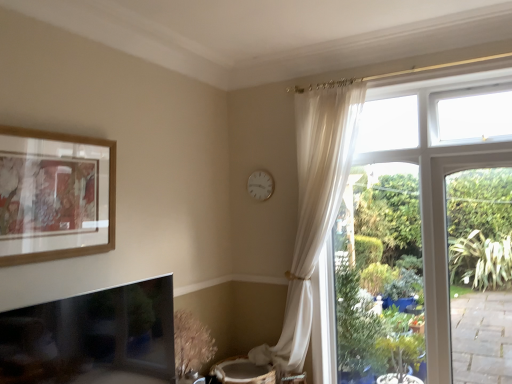
At what (x,y) coordinates should I click in order to perform the action: click on white plastic clock at upper center. Please return your answer as a coordinate pair (x, y). This screenshot has height=384, width=512. Looking at the image, I should click on (260, 185).

The image size is (512, 384). What do you see at coordinates (260, 185) in the screenshot?
I see `white plastic clock at upper center` at bounding box center [260, 185].

What is the approximate width of wooden picture frame at upper left?

It is 2.48 inches.

I want to click on wooden picture frame at upper left, so pyautogui.click(x=55, y=196).

In order to face wooden picture frame at upper left, should I rotate leftwards or rightwards?

Rotate left and turn 24.386 degrees.

This screenshot has width=512, height=384. Describe the element at coordinates (55, 196) in the screenshot. I see `wooden picture frame at upper left` at that location.

I want to click on white plastic clock at upper center, so click(260, 185).

Can you confirm if wooden picture frame at upper left is positioned to the left of white plastic clock at upper center?

Correct, you'll find wooden picture frame at upper left to the left of white plastic clock at upper center.

Relative to white plastic clock at upper center, is wooden picture frame at upper left in front or behind?

Visually, wooden picture frame at upper left is located in front of white plastic clock at upper center.

Is point (38, 150) closer or farther from the camera than point (252, 191)?

Point (38, 150) is positioned closer to the camera compared to point (252, 191).

From the image's perspective, does wooden picture frame at upper left appear lower than white plastic clock at upper center?

Correct, wooden picture frame at upper left appears lower than white plastic clock at upper center in the image.

From a real-world perspective, is wooden picture frame at upper left positioned under white plastic clock at upper center based on gravity?

Yes, from a real-world perspective, wooden picture frame at upper left is under white plastic clock at upper center.

Which of these two, wooden picture frame at upper left or white plastic clock at upper center, is wider?

With larger width is wooden picture frame at upper left.

Considering the relative sizes of wooden picture frame at upper left and white plastic clock at upper center in the image provided, is wooden picture frame at upper left shorter than white plastic clock at upper center?

No.

Between wooden picture frame at upper left and white plastic clock at upper center, which one has larger size?

With larger size is wooden picture frame at upper left.

Looking at this image, is wooden picture frame at upper left surrounding white plastic clock at upper center?

That's incorrect, white plastic clock at upper center is not inside wooden picture frame at upper left.

Would you consider wooden picture frame at upper left to be distant from white plastic clock at upper center?

Yes, wooden picture frame at upper left and white plastic clock at upper center are located far from each other.

Is wooden picture frame at upper left oriented towards white plastic clock at upper center?

No, wooden picture frame at upper left is not oriented towards white plastic clock at upper center.

Locate an element on the screen. The width and height of the screenshot is (512, 384). clock above the wooden picture frame at upper left (from the image's perspective) is located at coordinates (260, 185).

Is white plastic clock at upper center at the right side of wooden picture frame at upper left?

Yes, white plastic clock at upper center is to the right of wooden picture frame at upper left.

Considering their positions, is white plastic clock at upper center located in front of or behind wooden picture frame at upper left?

Clearly, white plastic clock at upper center is behind wooden picture frame at upper left.

Is point (250, 184) closer to viewer compared to point (18, 252)?

No, it is not.

From the image's perspective, is white plastic clock at upper center located above or below wooden picture frame at upper left?

white plastic clock at upper center is above wooden picture frame at upper left.

From a real-world perspective, who is located lower, white plastic clock at upper center or wooden picture frame at upper left?

wooden picture frame at upper left.

Which object is thinner, white plastic clock at upper center or wooden picture frame at upper left?

white plastic clock at upper center is thinner.

From their relative heights in the image, would you say white plastic clock at upper center is taller or shorter than wooden picture frame at upper left?

In the image, white plastic clock at upper center appears to be shorter than wooden picture frame at upper left.

Does white plastic clock at upper center have a smaller size compared to wooden picture frame at upper left?

Yes.

Which is correct: white plastic clock at upper center is inside wooden picture frame at upper left, or outside of it?

white plastic clock at upper center is outside wooden picture frame at upper left.

Are white plastic clock at upper center and wooden picture frame at upper left located far from each other?

Yes, white plastic clock at upper center and wooden picture frame at upper left are located far from each other.

Is white plastic clock at upper center oriented away from wooden picture frame at upper left?

No.

Can you tell me how much white plastic clock at upper center and wooden picture frame at upper left differ in facing direction?

The angular difference between white plastic clock at upper center and wooden picture frame at upper left is 89.8 degrees.

Find the location of a particular element. The image size is (512, 384). picture frame below the white plastic clock at upper center (from a real-world perspective) is located at coordinates (55, 196).

You are a GUI agent. You are given a task and a screenshot of the screen. Output one action in this format:
    pyautogui.click(x=<x>, y=<y>)
    Task: Click on the clock above the wooden picture frame at upper left (from the image's perspective)
    This screenshot has width=512, height=384.
    Given the screenshot: What is the action you would take?
    pyautogui.click(x=260, y=185)

The height and width of the screenshot is (384, 512). In order to click on picture frame lying in front of the white plastic clock at upper center in this screenshot , I will do `click(55, 196)`.